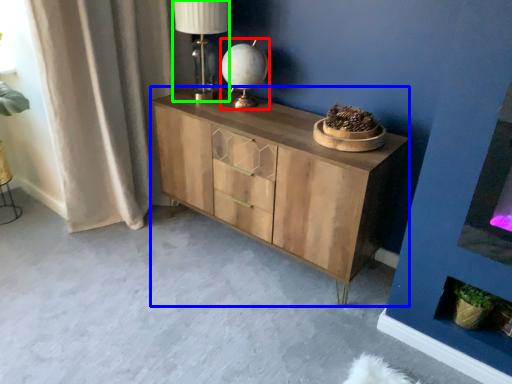
Question: Which object is the farthest from table lamp (highlighted by a red box)? Choose among these: chest of drawers (highlighted by a blue box) or table lamp (highlighted by a green box).

Choices:
 (A) chest of drawers
 (B) table lamp

Answer: (A)